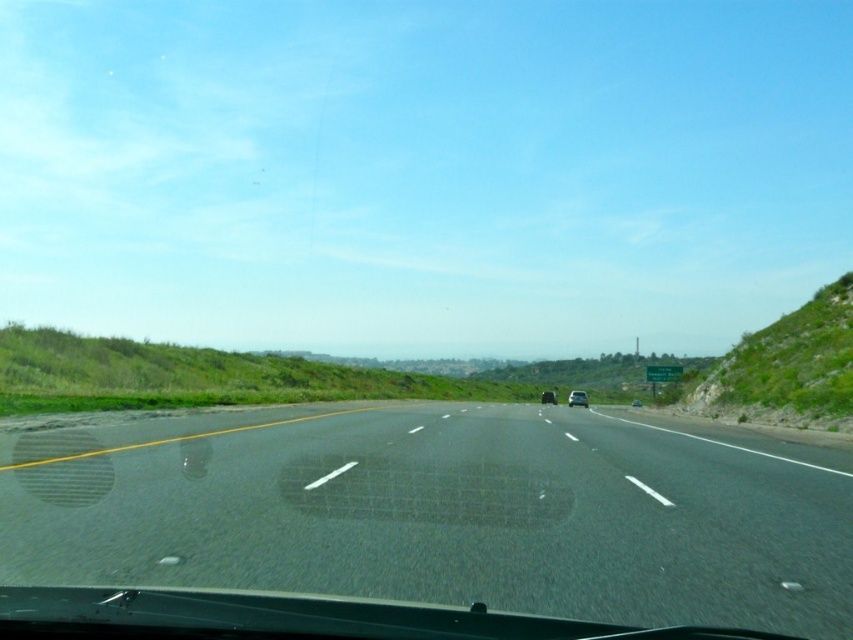
Can you confirm if silver metallic sedan at center is smaller than shiny silver sedan at center?

No, silver metallic sedan at center is not smaller than shiny silver sedan at center.

Does point (585, 396) come behind point (546, 403)?

No, (585, 396) is in front of (546, 403).

Find the location of a particular element. silver metallic sedan at center is located at coordinates (577, 397).

Can you confirm if black asphalt highway at center is positioned to the right of shiny silver sedan at center?

In fact, black asphalt highway at center is to the left of shiny silver sedan at center.

Is black asphalt highway at center behind shiny silver sedan at center?

No, it is in front of shiny silver sedan at center.

Is point (830, 525) in front of point (555, 394)?

That is True.

Locate an element on the screen. This screenshot has height=640, width=853. black asphalt highway at center is located at coordinates tap(444, 513).

Which is more to the right, black asphalt highway at center or silver metallic sedan at center?

silver metallic sedan at center is more to the right.

Is black asphalt highway at center smaller than silver metallic sedan at center?

Yes, black asphalt highway at center is smaller than silver metallic sedan at center.

Is point (608, 536) positioned before point (584, 404)?

Yes, it is in front of point (584, 404).

Locate an element on the screen. black asphalt highway at center is located at coordinates (444, 513).